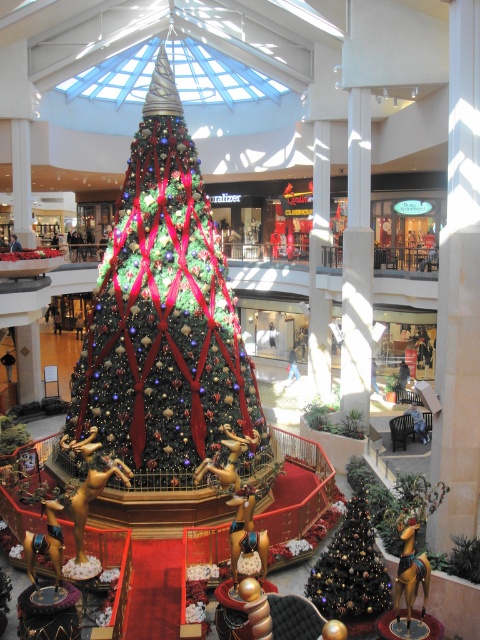
Question: Is shiny green and red ribbons at center to the left of shiny gold christmas tree at lower right from the viewer's perspective?

Choices:
 (A) yes
 (B) no

Answer: (A)

Question: Among these objects, which one is farthest from the camera?

Choices:
 (A) shiny green and red ribbons at center
 (B) shiny gold christmas tree at lower right

Answer: (A)

Question: Which point is farther from the camera taking this photo?

Choices:
 (A) (157, 144)
 (B) (381, 564)

Answer: (A)

Question: Is shiny green and red ribbons at center positioned in front of shiny gold christmas tree at lower right?

Choices:
 (A) yes
 (B) no

Answer: (B)

Question: Which object is closer to the camera taking this photo?

Choices:
 (A) shiny gold christmas tree at lower right
 (B) shiny green and red ribbons at center

Answer: (A)

Question: Observing the image, what is the correct spatial positioning of shiny green and red ribbons at center in reference to shiny gold christmas tree at lower right?

Choices:
 (A) left
 (B) right

Answer: (A)